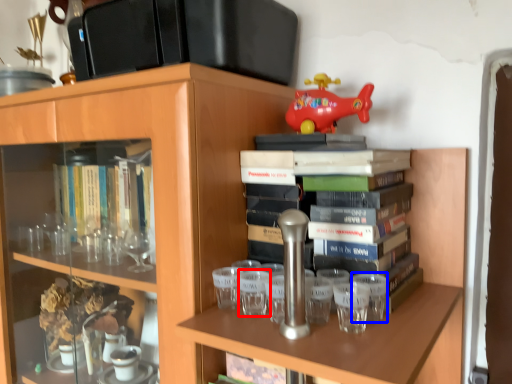
Question: Which of the following is the farthest to the observer, shot glass (highlighted by a red box) or shot glass (highlighted by a blue box)?

Choices:
 (A) shot glass
 (B) shot glass

Answer: (A)